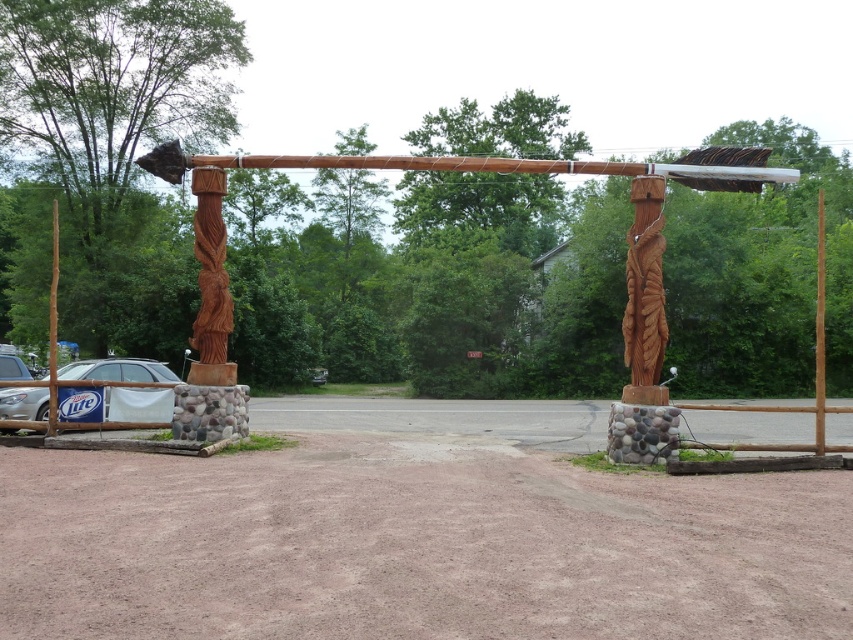
You are standing at the entrance of the archway and want to walk to the brown gravel dirt track at center. In which direction should you walk relative to the archway?

The brown gravel dirt track at center is located at coordinates (x=413, y=545), so you should walk forward towards the center to reach it.

You are planning to drive a small toy car along the brown gravel dirt track at center and the silver metallic car at lower left. Which path has enough space for the toy car to move freely?

The silver metallic car at lower left has more space than the brown gravel dirt track at center, so the toy car can move freely there.

You are standing at the base of the rustic wooden archway and want to walk to the silver metallic car at lower left. Which direction should you head relative to the brown gravel dirt track at center?

You should head towards the silver metallic car at lower left, which is above the brown gravel dirt track at center. Since the track is below the car, you need to walk towards the direction where the track is located but adjust your path upwards to reach the car.